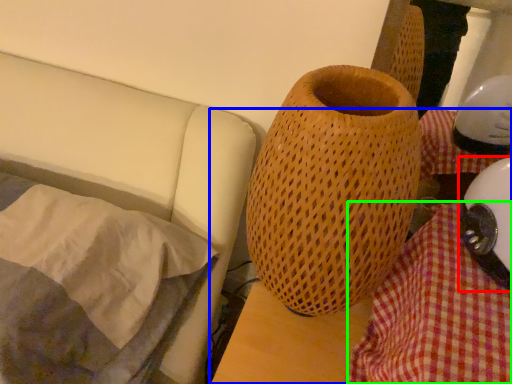
Question: Which is nearer to the helmet (highlighted by a red box)? table (highlighted by a blue box) or blanket (highlighted by a green box).

Choices:
 (A) table
 (B) blanket

Answer: (B)